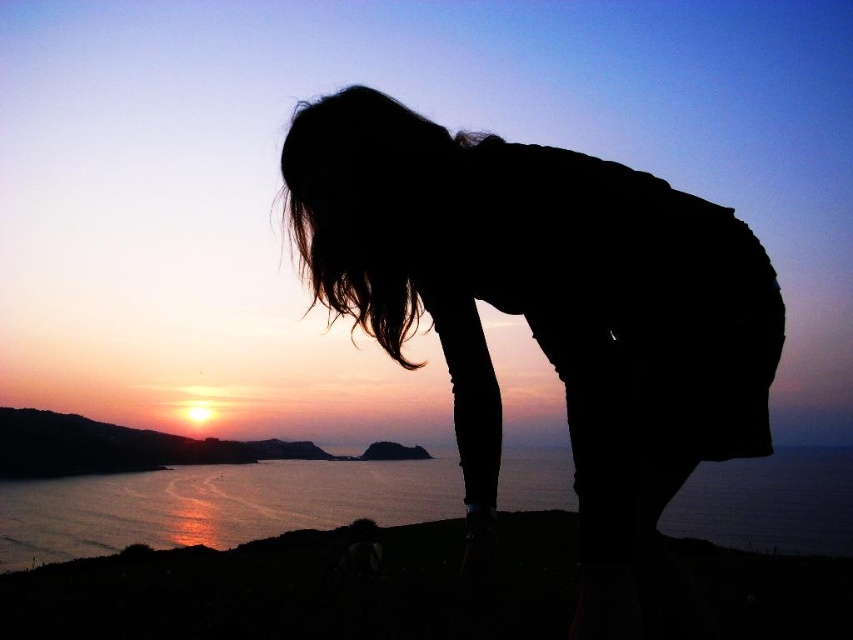
You are an observer at the scene. You see the silhouette figure at center and the glistening water at lower left. Which object is taller?

The glistening water at lower left is taller than the silhouette figure at center.

You are a photographer planning to capture the silhouette figure at center and the glistening water at lower left in a single frame. Given that your camera has a fixed focal length, which object would you prioritize positioning closer to the edge of the frame to ensure both fit without cropping?

The silhouette figure at center should be positioned closer to the edge of the frame because its width is smaller than the glistening water at lower left, allowing more space for the wider water area.